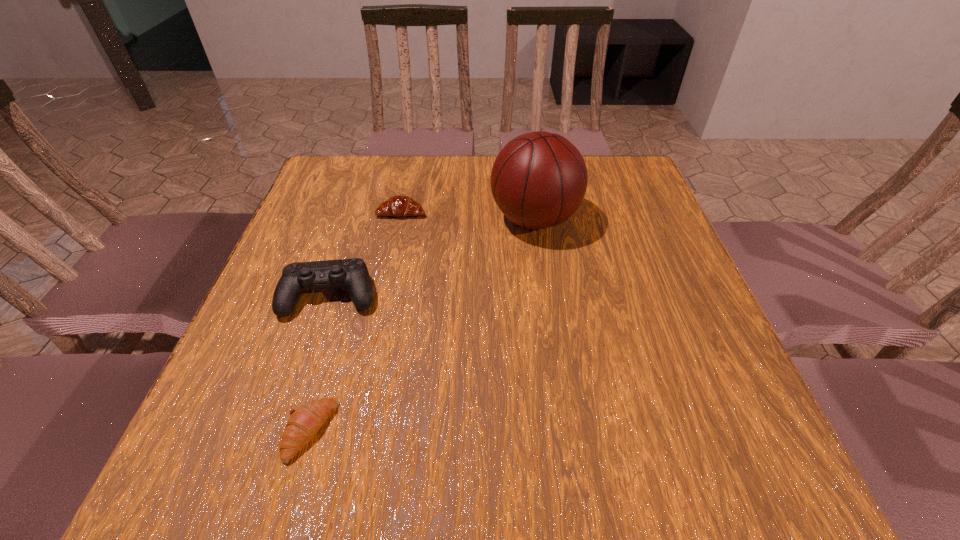
Identify the location of vacant space at the right edge. This screenshot has height=540, width=960. click(668, 232).

Where is `blank area at the near left corner`? The width and height of the screenshot is (960, 540). blank area at the near left corner is located at coordinates (217, 455).

Where is `vacant space at the far right corner of the desktop`? The image size is (960, 540). vacant space at the far right corner of the desktop is located at coordinates (607, 184).

Where is `empty location between the control and the taller crescent roll`? The height and width of the screenshot is (540, 960). empty location between the control and the taller crescent roll is located at coordinates (366, 254).

Locate an element on the screen. The width and height of the screenshot is (960, 540). vacant space that's between the second shortest object and the shortest object is located at coordinates (356, 322).

What are the coordinates of `free space between the shorter crescent roll and the control` in the screenshot? It's located at (321, 363).

Locate an element on the screen. The image size is (960, 540). free spot between the farther crescent roll and the basketball is located at coordinates (468, 215).

Find the location of a particular element. The width and height of the screenshot is (960, 540). empty location between the shorter crescent roll and the second shortest object is located at coordinates (356, 322).

Identify the location of vacant region between the tallest object and the third shortest object. (432, 257).

This screenshot has height=540, width=960. In order to click on empty location between the nearest object and the tallest object in this screenshot , I will do `click(422, 325)`.